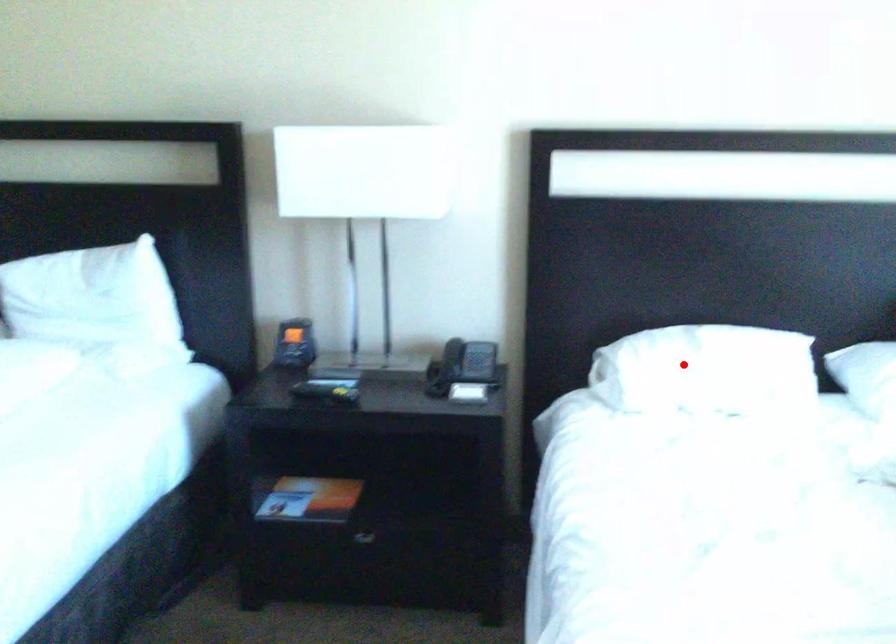
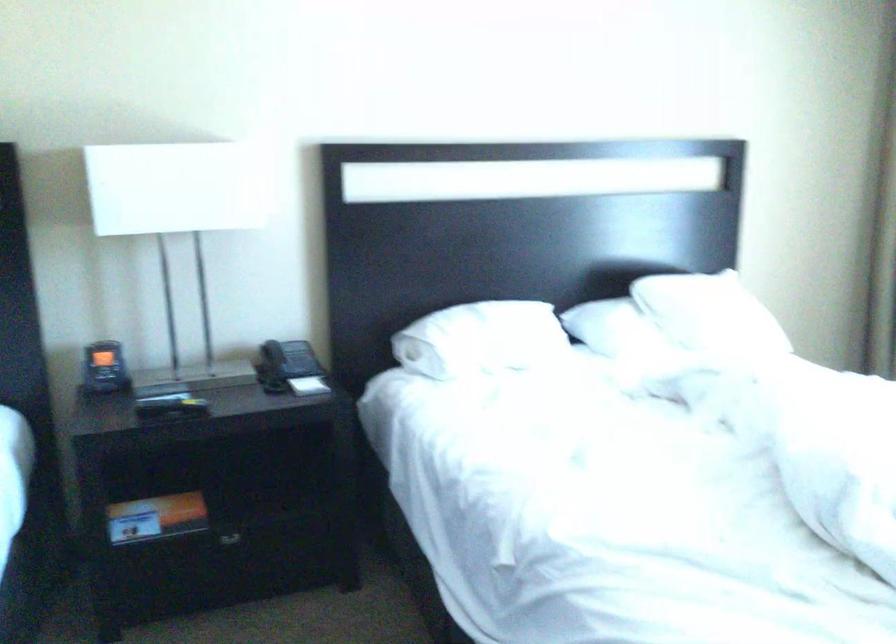
Locate, in the second image, the point that corresponds to the highlighted location in the first image.

(479, 339)